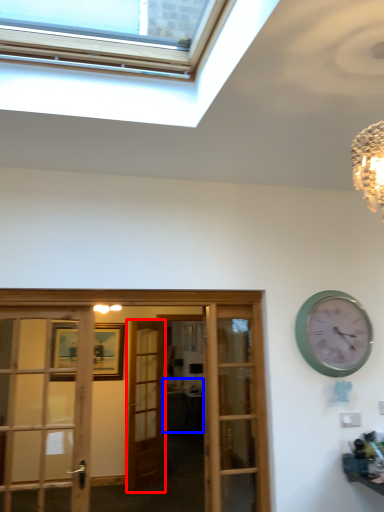
Question: Which object is further to the camera taking this photo, door (highlighted by a red box) or studio couch (highlighted by a blue box)?

Choices:
 (A) door
 (B) studio couch

Answer: (B)